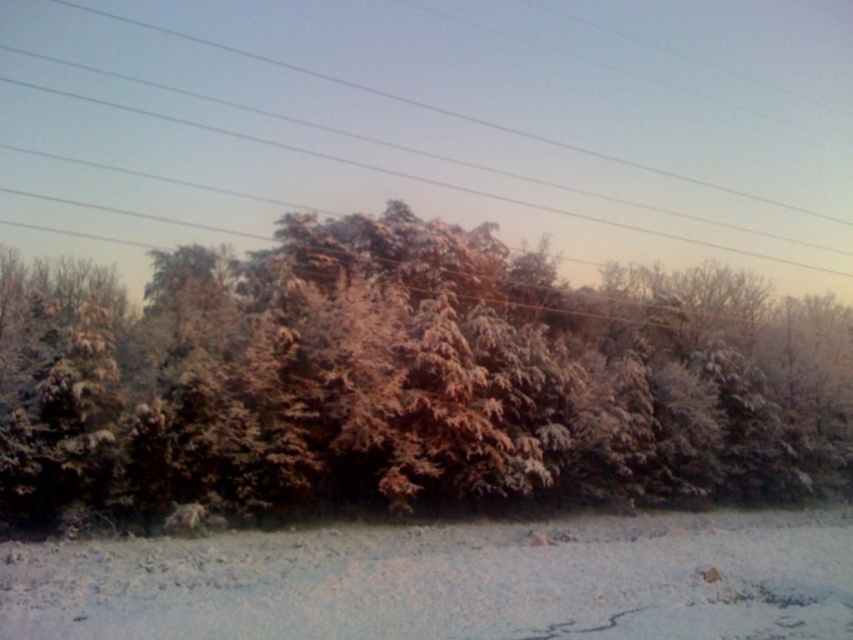
You are an observer standing in the snow and see the white frosty trees at center and the smooth wire at upper center. Which object is closer to the ground?

The white frosty trees at center are closer to the ground than the smooth wire at upper center because they are shorter in height.

You are an artist planning to sketch the winter landscape. You want to ensure the white frosty trees at center and smooth wire at upper center are proportionally accurate. Which object should you draw first to maintain the correct spatial relationship?

You should draw the smooth wire at upper center first because it occupies more space than the white frosty trees at center, ensuring proper scaling before adding smaller elements.

You are an observer standing at the edge of the snowy landscape. You notice the white frosty trees at center and the smooth wire at upper center. Which object is positioned to the right of the other?

The white frosty trees at center are to the right of smooth wire at upper center.